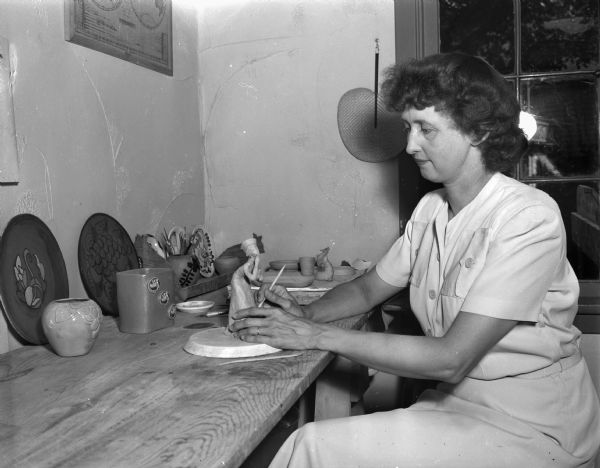
Locate an element on the screen. framed art is located at coordinates (140, 25).